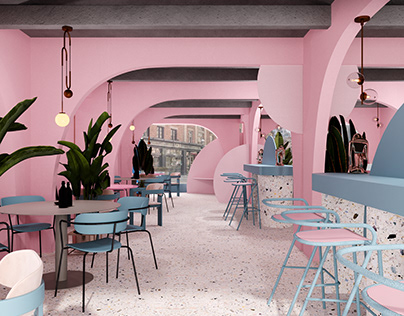
Locate an element on the screen. Image resolution: width=404 pixels, height=316 pixels. light is located at coordinates (61, 120).